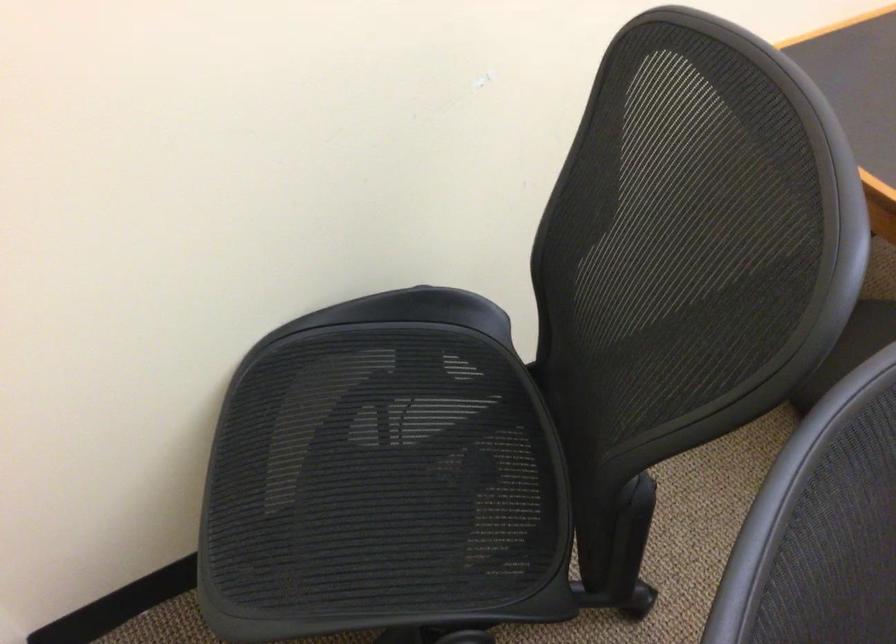
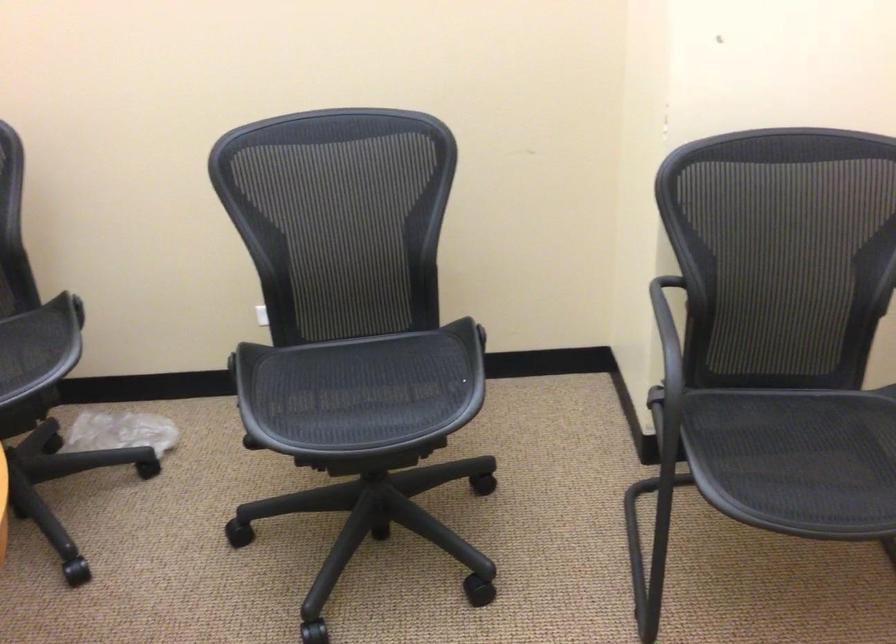
Question: The camera is either moving clockwise (left) or counter-clockwise (right) around the object. The first image is from the beginning of the video and the second image is from the end. Is the camera moving left or right when shooting the video?

Choices:
 (A) Left
 (B) Right

Answer: (A)